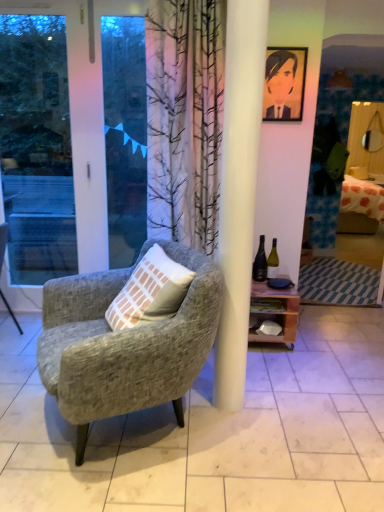
Measure the distance between textured gray armchair at center, acting as the first chair starting from the right, and camera.

1.52 meters.

Describe the element at coordinates (260, 262) in the screenshot. I see `green glass bottle at center-right, the first bottle from the left` at that location.

The height and width of the screenshot is (512, 384). Find the location of `textured gray armchair at left, the 2th chair in the right-to-left sequence`. textured gray armchair at left, the 2th chair in the right-to-left sequence is located at coordinates (3, 242).

Describe the element at coordinates (72, 143) in the screenshot. I see `transparent glass door at left` at that location.

What do you see at coordinates (125, 136) in the screenshot? I see `transparent glass window at left` at bounding box center [125, 136].

What is the approximate height of transparent glass window at left?

4.49 feet.

You are a GUI agent. You are given a task and a screenshot of the screen. Output one action in this format:
    pyautogui.click(x=<x>, y=<y>)
    Task: Click on the textured gray armchair at center, acting as the first chair starting from the right
    
    Given the screenshot: What is the action you would take?
    pyautogui.click(x=124, y=344)

Based on the photo, considering the sizes of objects transparent glass door at left and green glass bottle at center-right, which is the second bottle from right to left, in the image provided, who is thinner, transparent glass door at left or green glass bottle at center-right, which is the second bottle from right to left,?

transparent glass door at left.

Is transparent glass door at left facing away from green glass bottle at center-right, the first bottle from the left?

No, green glass bottle at center-right, the first bottle from the left, is not at the back of transparent glass door at left.

Which of these two, transparent glass door at left or green glass bottle at center-right, which is the second bottle from right to left, is bigger?

transparent glass door at left.

Does textured gray armchair at center, the 2th chair in the left-to-right sequence, have a greater width compared to transparent glass door at left?

Yes.

Is textured gray armchair at center, the 2th chair in the left-to-right sequence, in front of or behind transparent glass door at left in the image?

In the image, textured gray armchair at center, the 2th chair in the left-to-right sequence, appears in front of transparent glass door at left.

Is textured gray armchair at center, acting as the first chair starting from the right, taller than transparent glass door at left?

No, textured gray armchair at center, acting as the first chair starting from the right, is not taller than transparent glass door at left.

From a real-world perspective, is textured gray armchair at center, acting as the first chair starting from the right, on transparent glass door at left?

No.

Considering the relative sizes of textured gray armchair at center, acting as the first chair starting from the right, and textured gray armchair at left, the 2th chair in the right-to-left sequence, in the image provided, is textured gray armchair at center, acting as the first chair starting from the right, shorter than textured gray armchair at left, the 2th chair in the right-to-left sequence,?

Incorrect, the height of textured gray armchair at center, acting as the first chair starting from the right, does not fall short of that of textured gray armchair at left, the 2th chair in the right-to-left sequence.

Can we say textured gray armchair at center, acting as the first chair starting from the right, lies outside textured gray armchair at left, which ranks as the 1th chair in left-to-right order?

Indeed, textured gray armchair at center, acting as the first chair starting from the right, is completely outside textured gray armchair at left, which ranks as the 1th chair in left-to-right order.

Is textured gray armchair at center, the 2th chair in the left-to-right sequence, wider than textured gray armchair at left, the 2th chair in the right-to-left sequence?

Indeed, textured gray armchair at center, the 2th chair in the left-to-right sequence, has a greater width compared to textured gray armchair at left, the 2th chair in the right-to-left sequence.

Identify the location of chair above the textured gray armchair at center, the 2th chair in the left-to-right sequence (from a real-world perspective). The image size is (384, 512). (3, 242).

Is there a large distance between matte black portrait at upper right and textured gray armchair at center, the 2th chair in the left-to-right sequence?

Yes, matte black portrait at upper right and textured gray armchair at center, the 2th chair in the left-to-right sequence, are located far from each other.

From the image's perspective, which chair is the 2nd one below the matte black portrait at upper right? Please provide its 2D coordinates.

[(124, 344)]

Considering the relative sizes of matte black portrait at upper right and textured gray armchair at center, the 2th chair in the left-to-right sequence, in the image provided, is matte black portrait at upper right taller than textured gray armchair at center, the 2th chair in the left-to-right sequence,?

No, matte black portrait at upper right is not taller than textured gray armchair at center, the 2th chair in the left-to-right sequence.

Which is behind, matte black portrait at upper right or textured gray armchair at center, the 2th chair in the left-to-right sequence?

matte black portrait at upper right is more distant.

Which object is thinner, matte black portrait at upper right or green glass bottle at center-right, the first bottle from the left?

Thinner between the two is matte black portrait at upper right.

From a real-world perspective, is matte black portrait at upper right located higher than green glass bottle at center-right, the first bottle from the left?

Correct, in the physical world, matte black portrait at upper right is higher than green glass bottle at center-right, the first bottle from the left.

Is point (288, 70) more distant than point (262, 258)?

No.

In terms of size, does matte black portrait at upper right appear bigger or smaller than green glass bottle at center-right, which is the second bottle from right to left?

Clearly, matte black portrait at upper right is larger in size than green glass bottle at center-right, which is the second bottle from right to left.

Is matte black portrait at upper right positioned behind transparent glass window at left?

Yes, the depth of matte black portrait at upper right is greater than that of transparent glass window at left.

From the image's perspective, which object appears higher, matte black portrait at upper right or transparent glass window at left?

matte black portrait at upper right appears higher in the image.

Is matte black portrait at upper right bigger than transparent glass window at left?

Actually, matte black portrait at upper right might be smaller than transparent glass window at left.

From their relative heights in the image, would you say matte black portrait at upper right is taller or shorter than transparent glass window at left?

matte black portrait at upper right is shorter than transparent glass window at left.

Is textured gray armchair at left, which ranks as the 1th chair in left-to-right order, taller or shorter than matte black portrait at upper right?

Considering their sizes, textured gray armchair at left, which ranks as the 1th chair in left-to-right order, has more height than matte black portrait at upper right.

Considering the sizes of objects textured gray armchair at left, which ranks as the 1th chair in left-to-right order, and matte black portrait at upper right in the image provided, who is smaller, textured gray armchair at left, which ranks as the 1th chair in left-to-right order, or matte black portrait at upper right?

matte black portrait at upper right is smaller.

Considering the positions of objects textured gray armchair at left, which ranks as the 1th chair in left-to-right order, and matte black portrait at upper right in the image provided, who is more to the left, textured gray armchair at left, which ranks as the 1th chair in left-to-right order, or matte black portrait at upper right?

Positioned to the left is textured gray armchair at left, which ranks as the 1th chair in left-to-right order.

What are the coordinates of `bottle that is the 1st one when counting downward from the transparent glass door at left (from the image's perspective)` in the screenshot? It's located at (260, 262).

From a real-world perspective, count 2nd chairs downward from the transparent glass door at left and point to it. Please provide its 2D coordinates.

[(124, 344)]

Considering their positions, is wooden at right positioned closer to textured gray armchair at left, which ranks as the 1th chair in left-to-right order, than transparent glass window at left?

transparent glass window at left.

When comparing their distances from wooden at right, does white glass bottle at right, which ranks as the first bottle in right-to-left order, or textured gray armchair at center, the 2th chair in the left-to-right sequence, seem closer?

The object closer to wooden at right is white glass bottle at right, which ranks as the first bottle in right-to-left order.

From the picture: Considering their positions, is textured gray armchair at left, which ranks as the 1th chair in left-to-right order, positioned further to green glass bottle at center-right, the first bottle from the left, than transparent glass door at left?

transparent glass door at left.

Consider the image. Which object lies further to the anchor point green glass bottle at center-right, the first bottle from the left, transparent glass window at left or textured gray armchair at center, acting as the first chair starting from the right?

Among the two, textured gray armchair at center, acting as the first chair starting from the right, is located further to green glass bottle at center-right, the first bottle from the left.

Considering their positions, is wooden at right positioned closer to white glass bottle at right, the 2th bottle from the left, than textured gray armchair at center, the 2th chair in the left-to-right sequence?

Based on the image, wooden at right appears to be nearer to white glass bottle at right, the 2th bottle from the left.

From the image, which object appears to be nearer to transparent glass window at left, green glass bottle at center-right, the first bottle from the left, or textured gray armchair at center, the 2th chair in the left-to-right sequence?

green glass bottle at center-right, the first bottle from the left, is closer to transparent glass window at left.

From the picture: Looking at the image, which one is located closer to transparent glass window at left, textured gray armchair at left, the 2th chair in the right-to-left sequence, or textured gray armchair at center, the 2th chair in the left-to-right sequence?

Among the two, textured gray armchair at left, the 2th chair in the right-to-left sequence, is located nearer to transparent glass window at left.

When comparing their distances from wooden at right, does green glass bottle at center-right, the first bottle from the left, or textured gray armchair at left, which ranks as the 1th chair in left-to-right order, seem closer?

Among the two, green glass bottle at center-right, the first bottle from the left, is located nearer to wooden at right.

You are a GUI agent. You are given a task and a screenshot of the screen. Output one action in this format:
    pyautogui.click(x=<x>, y=<y>)
    Task: Click on the screen door located between textured gray armchair at left, which ranks as the 1th chair in left-to-right order, and wooden at right in the left-right direction
    
    Given the screenshot: What is the action you would take?
    pyautogui.click(x=72, y=143)

Locate an element on the screen. This screenshot has height=512, width=384. chair located between transparent glass door at left and white glass bottle at right, the 2th bottle from the left, in the left-right direction is located at coordinates (124, 344).

Identify the location of chair between textured gray armchair at left, the 2th chair in the right-to-left sequence, and matte black portrait at upper right. Image resolution: width=384 pixels, height=512 pixels. (124, 344).

Locate an element on the screen. chair located between textured gray armchair at center, the 2th chair in the left-to-right sequence, and transparent glass door at left in the depth direction is located at coordinates tap(3, 242).